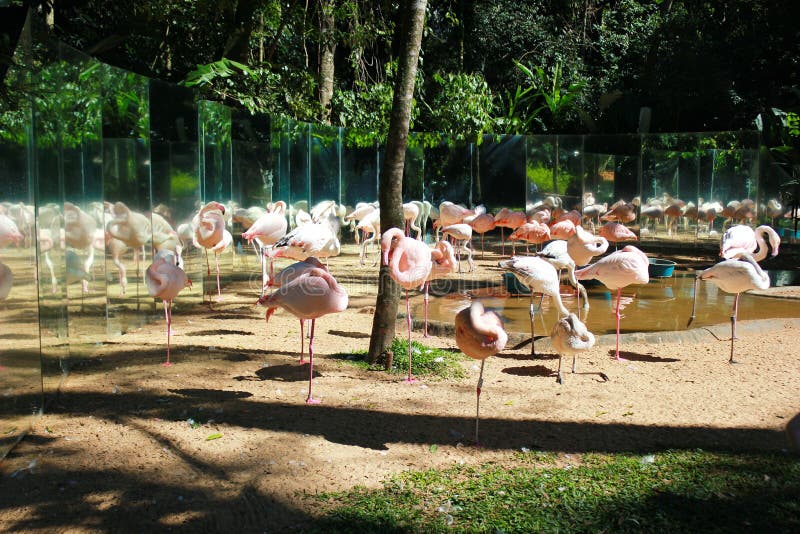
In order to click on mirror wall in back of pen in this screenshot , I will do `click(542, 166)`, `click(646, 179)`.